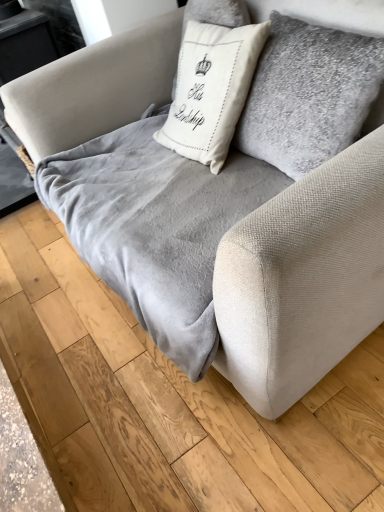
Question: In the image, is velvet gray blanket at center positioned in front of or behind white cotton cushion at center?

Choices:
 (A) behind
 (B) front

Answer: (B)

Question: Is point (205, 265) positioned closer to the camera than point (203, 161)?

Choices:
 (A) farther
 (B) closer

Answer: (B)

Question: From a real-world perspective, relative to white cotton cushion at center, is velvet gray blanket at center vertically above or below?

Choices:
 (A) above
 (B) below

Answer: (B)

Question: From a real-world perspective, is white cotton cushion at center above or below velvet gray blanket at center?

Choices:
 (A) below
 (B) above

Answer: (B)

Question: In terms of height, does white cotton cushion at center look taller or shorter compared to velvet gray blanket at center?

Choices:
 (A) short
 (B) tall

Answer: (B)

Question: Does point (192, 82) appear closer or farther from the camera than point (182, 324)?

Choices:
 (A) closer
 (B) farther

Answer: (B)

Question: Is white cotton cushion at center spatially inside velvet gray blanket at center, or outside of it?

Choices:
 (A) outside
 (B) inside

Answer: (A)